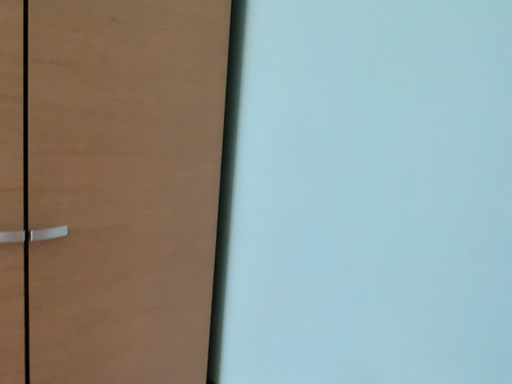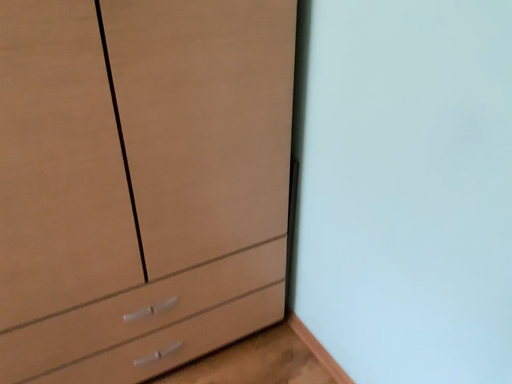
Question: Which way did the camera rotate in the video?

Choices:
 (A) rotated left
 (B) rotated right

Answer: (A)